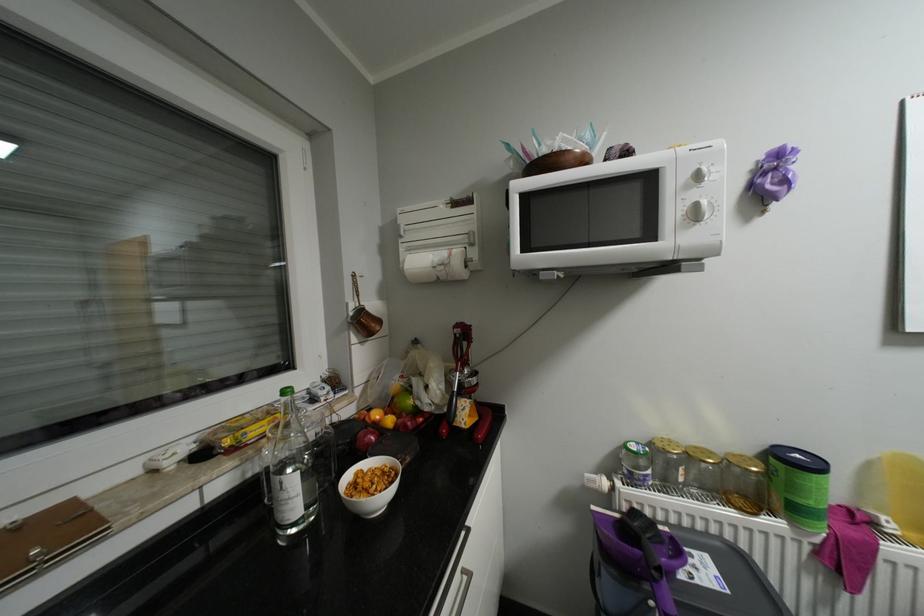
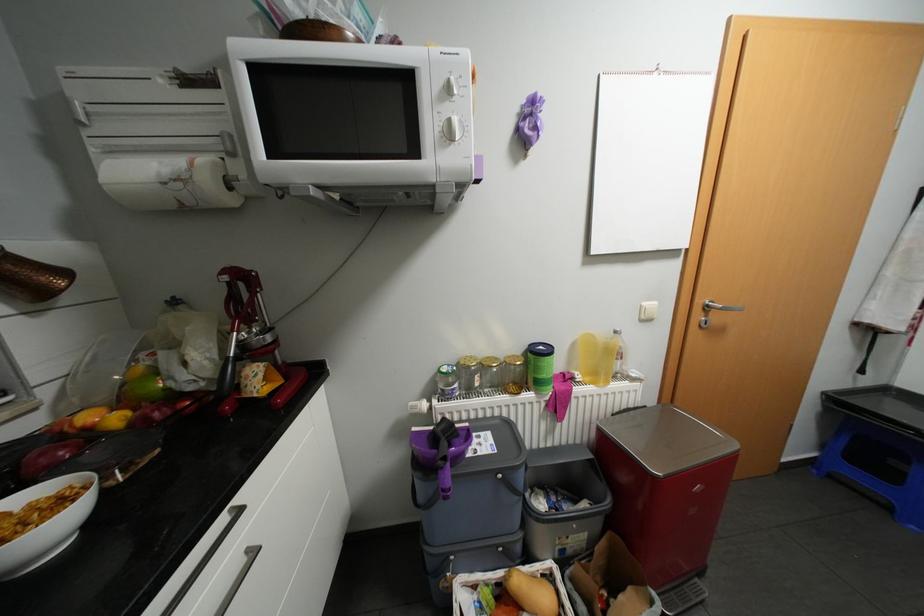
Find the pixel in the second image that matches the point at 397,419 in the first image.

(123, 418)